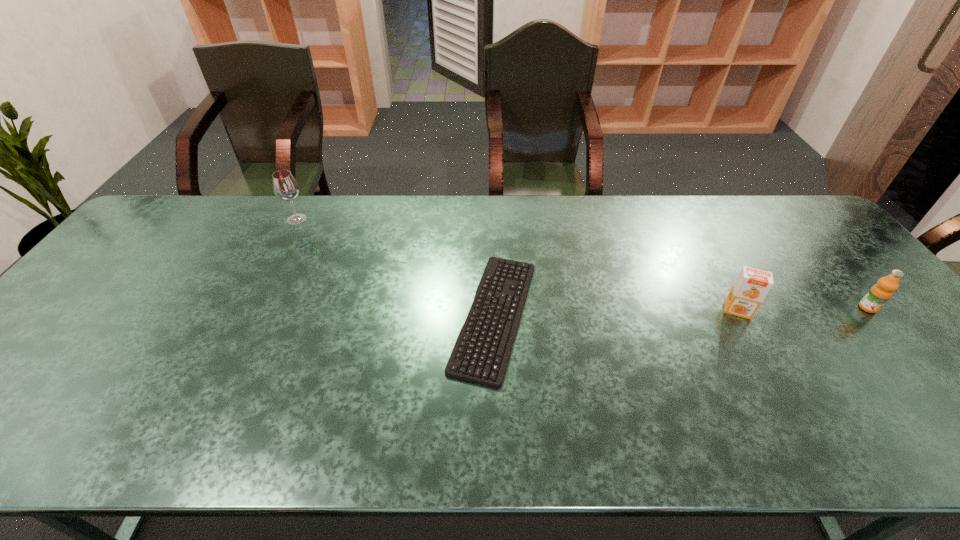
Locate an element on the screen. Image resolution: width=960 pixels, height=540 pixels. vacant area between the third object from right to left and the left orange juice is located at coordinates (616, 313).

Where is `free space between the second object from left to right and the third object from left to right`? The height and width of the screenshot is (540, 960). free space between the second object from left to right and the third object from left to right is located at coordinates [616, 313].

In order to click on vacant space in between the third object from right to left and the right orange juice in this screenshot , I will do `click(681, 312)`.

This screenshot has height=540, width=960. Identify the location of free space that is in between the wineglass and the shortest object. (396, 267).

Identify the location of the third closest object relative to the wineglass. The width and height of the screenshot is (960, 540). (880, 293).

Identify which object is the closest to the leftmost object. Please provide its 2D coordinates. Your answer should be formatted as a tuple, i.e. [(x, y)], where the tuple contains the x and y coordinates of a point satisfying the conditions above.

[(494, 265)]

Image resolution: width=960 pixels, height=540 pixels. Find the location of `vacant area that satisfies the following two spatial constraints: 1. on the front side of the computer keyboard; 2. on the right side of the farthest object`. vacant area that satisfies the following two spatial constraints: 1. on the front side of the computer keyboard; 2. on the right side of the farthest object is located at coordinates (250, 315).

This screenshot has height=540, width=960. I want to click on vacant area in the image that satisfies the following two spatial constraints: 1. on the front side of the leftmost object; 2. on the right side of the third object from right to left, so click(x=250, y=315).